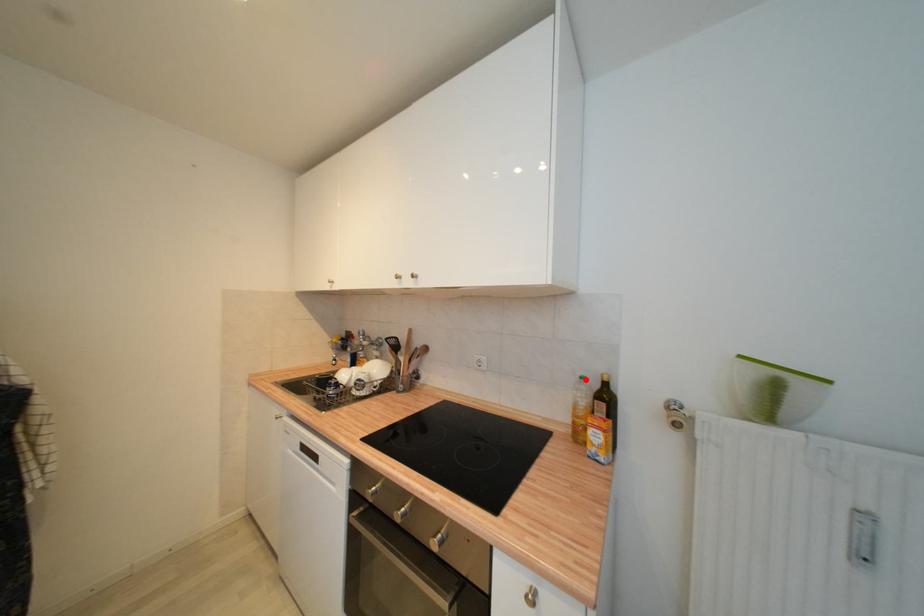
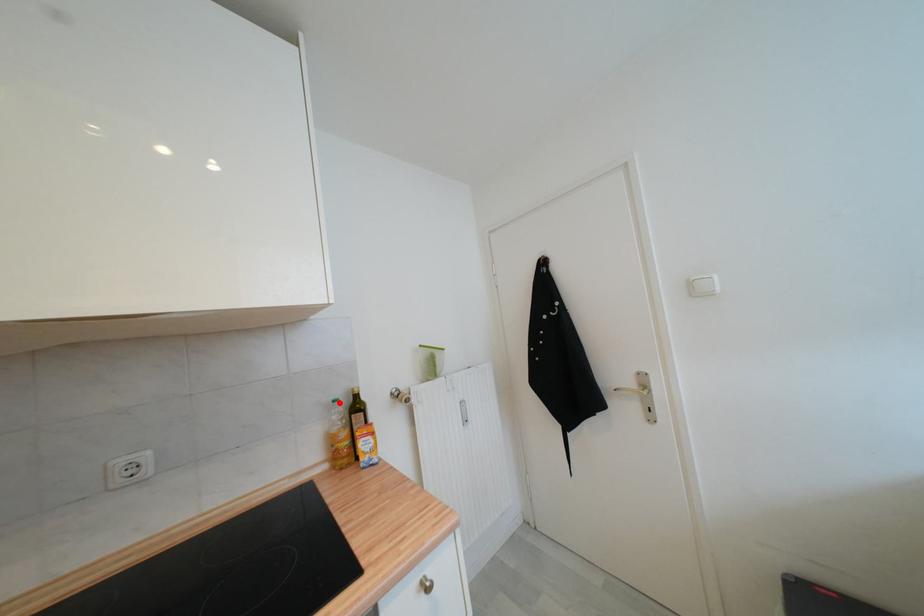
I am providing you with two images of the same scene from different viewpoints. A red point is marked on the first image and another point is marked on the second image. Is the red point in image1 aligned with the point shown in image2?

Yes